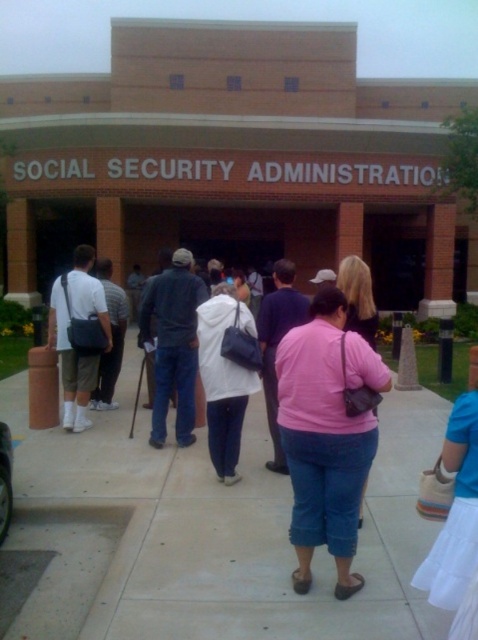
You are a photographer trying to capture a shot of the pink matte shirt at center and the white matte shirt at center in the scene. Which of the two shirts is positioned lower in the image?

The pink matte shirt at center is located below the white matte shirt at center, so the pink matte shirt at center is positioned lower in the image.

You are a delivery person trying to place a heavy box on the ground near the cement sidewalk at center and the pink matte shirt at center. Which object can you place the box on?

The cement sidewalk at center has a lesser height compared to the pink matte shirt at center, so you can place the box on the cement sidewalk at center.